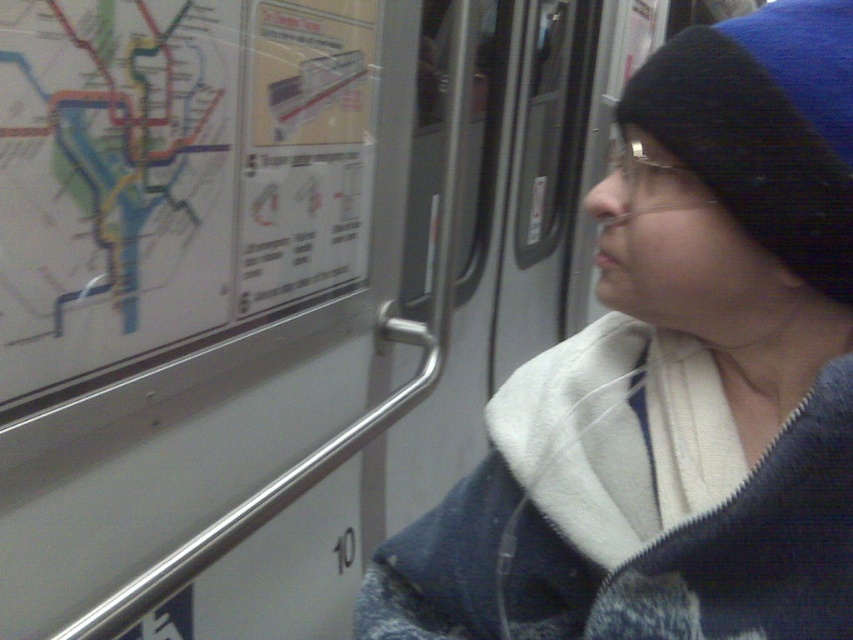
Is white paper map at upper left bigger than blue knit hat at upper right?

Indeed, white paper map at upper left has a larger size compared to blue knit hat at upper right.

Between point (138, 76) and point (712, 56), which one is positioned in front?

Point (712, 56) is in front.

What do you see at coordinates (173, 173) in the screenshot?
I see `white paper map at upper left` at bounding box center [173, 173].

Where is `white paper map at upper left`? Image resolution: width=853 pixels, height=640 pixels. white paper map at upper left is located at coordinates (173, 173).

Does blue knit beanie at upper right appear on the left side of white paper map at upper left?

No, blue knit beanie at upper right is not to the left of white paper map at upper left.

Which is more to the right, blue knit beanie at upper right or white paper map at upper left?

blue knit beanie at upper right is more to the right.

Between point (718, 156) and point (83, 371), which one is positioned behind?

Point (83, 371)

The height and width of the screenshot is (640, 853). I want to click on blue knit beanie at upper right, so click(x=676, y=378).

Which of these two, blue knit beanie at upper right or blue knit hat at upper right, stands taller?

Standing taller between the two is blue knit beanie at upper right.

Is point (602, 369) behind point (833, 268)?

Yes, it is behind point (833, 268).

I want to click on blue knit beanie at upper right, so (676, 378).